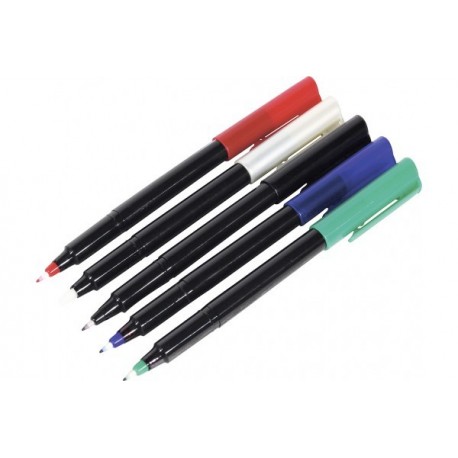
This screenshot has width=458, height=458. I want to click on covers, so click(338, 222), click(327, 191), click(305, 161), click(274, 137), click(263, 122).